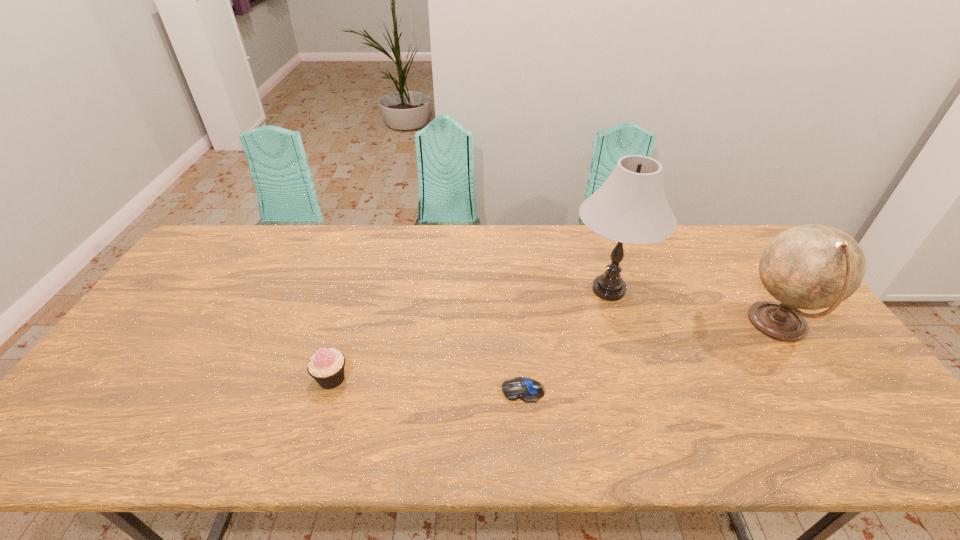
Image resolution: width=960 pixels, height=540 pixels. Identify the location of free space between the third object from right to left and the leftmost object. (427, 384).

Where is `free spot between the tallest object and the third shortest object`? The width and height of the screenshot is (960, 540). free spot between the tallest object and the third shortest object is located at coordinates (693, 307).

Identify the location of free space between the globe and the third tallest object. (555, 352).

This screenshot has width=960, height=540. Find the location of `the closest object to the shortest object`. the closest object to the shortest object is located at coordinates (630, 207).

This screenshot has height=540, width=960. I want to click on object that stands as the second closest to the cupcake, so click(x=630, y=207).

The width and height of the screenshot is (960, 540). Find the location of `vacant area that satisfies the following two spatial constraints: 1. on the front-facing side of the globe; 2. on the front side of the leftmost object`. vacant area that satisfies the following two spatial constraints: 1. on the front-facing side of the globe; 2. on the front side of the leftmost object is located at coordinates (815, 379).